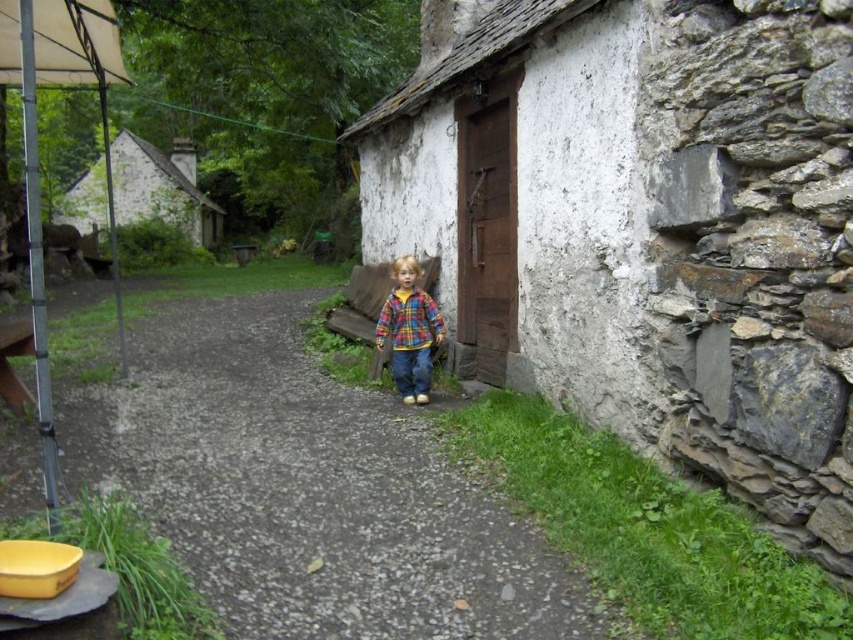
You are a photographer trying to capture the child in the plaid fabric shirt at center while ensuring the gravel path at center is visible in the background. Based on their positions, which object is closer to the camera?

The plaid fabric shirt at center is closer to the camera because the gravel path at center is positioned to its left side, indicating it is behind the shirt.

You are a photographer trying to capture the child in the scene. Since the gravel path at center and the plaid fabric shirt at center are both at center, which one is closer to the camera?

The gravel path at center has a lesser height compared to the plaid fabric shirt at center, so the gravel path at center is closer to the camera.

You are a photographer trying to capture the white plastered wall at center in your shot. According to the coordinates provided, where exactly should you position your camera to ensure the wall is centered in the frame?

The white plastered wall at center is located at coordinates point (643, 227), so to center it in your shot, position your camera so that the crosshairs align with those coordinates.